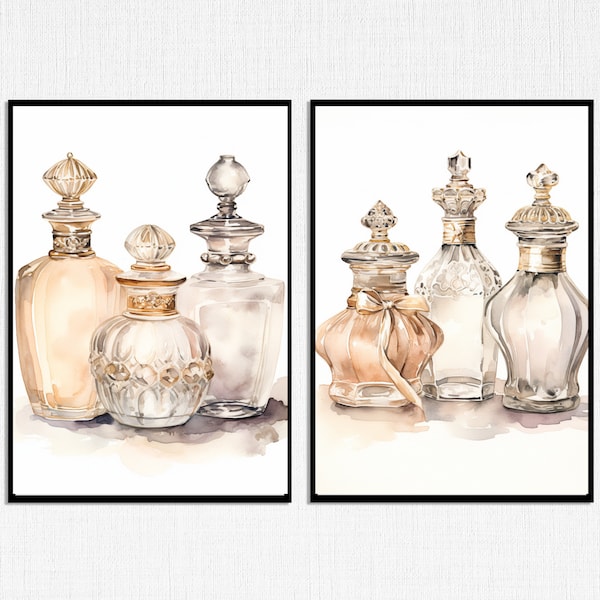
Locate an element on the screen. tall cream vase is located at coordinates (63, 315).